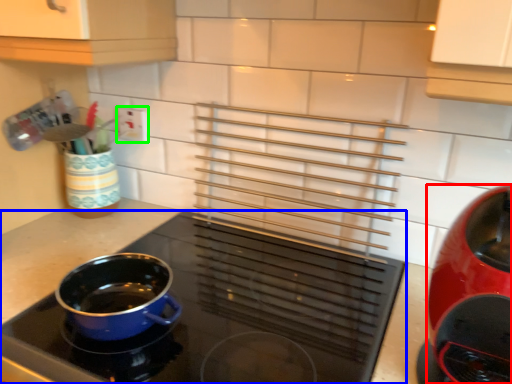
Question: Considering the real-world distances, which object is closest to kitchen appliance (highlighted by a red box)? kitchen appliance (highlighted by a blue box) or electric outlet (highlighted by a green box).

Choices:
 (A) kitchen appliance
 (B) electric outlet

Answer: (A)